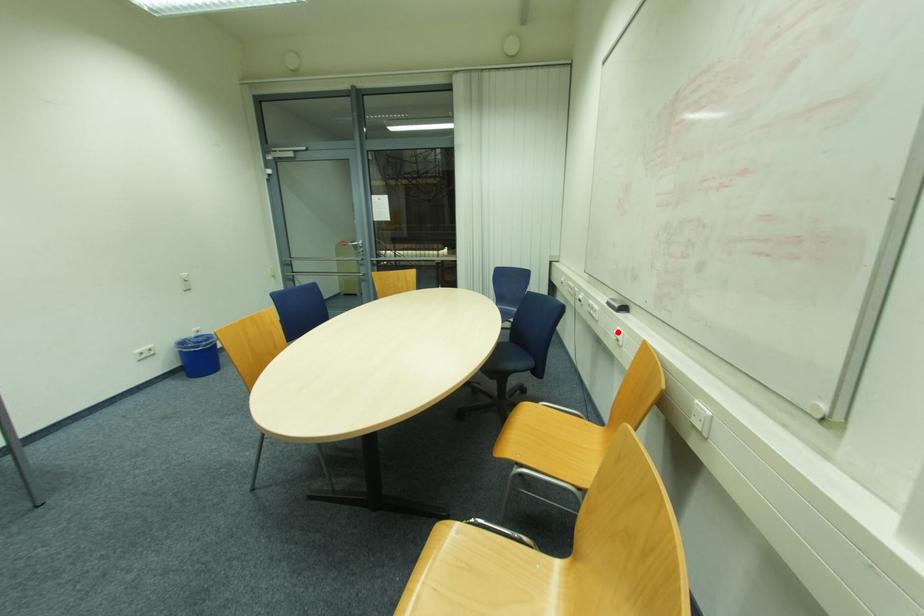
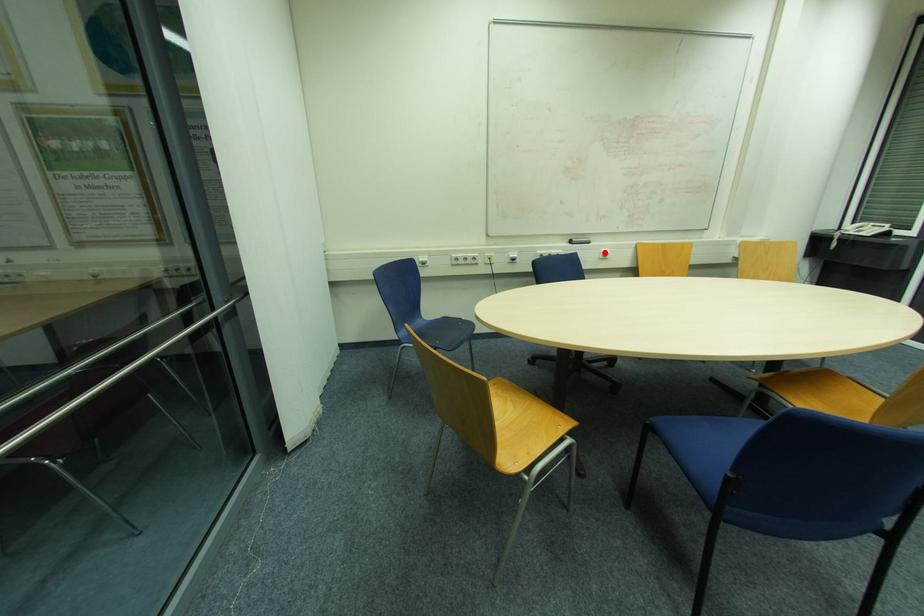
I am providing you with two images of the same scene from different viewpoints. A red point is marked on the first image and another point is marked on the second image. Is the red point in image1 aligned with the point shown in image2?

Yes